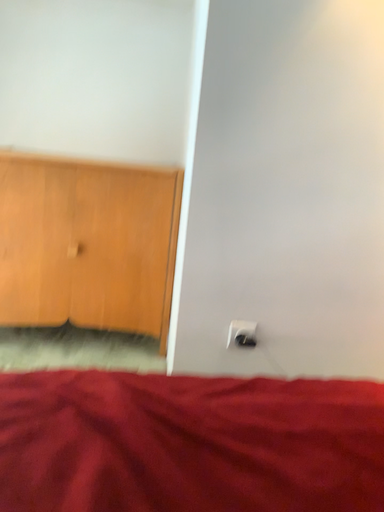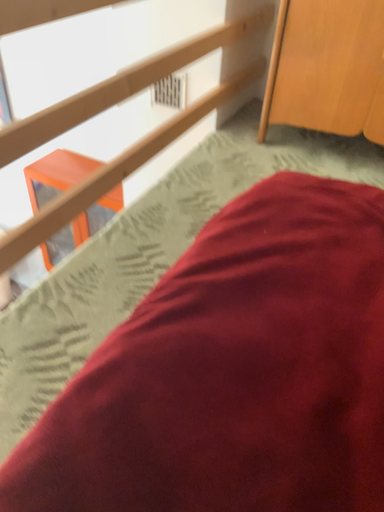
Question: How did the camera likely rotate when shooting the video?

Choices:
 (A) rotated left
 (B) rotated right

Answer: (A)